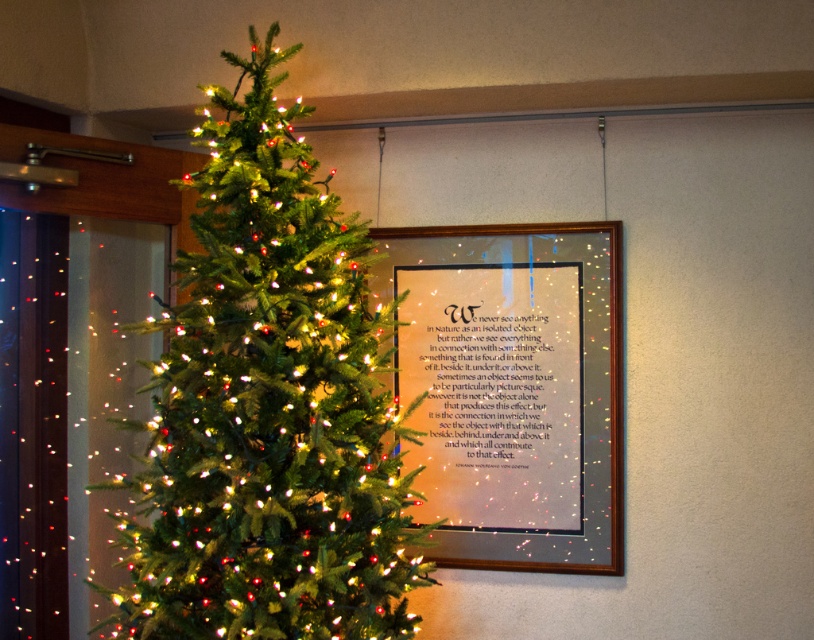
Question: Can you confirm if green matte christmas tree at center is thinner than matte silver frame at center?

Choices:
 (A) yes
 (B) no

Answer: (B)

Question: Which point is farther from the camera taking this photo?

Choices:
 (A) (357, 392)
 (B) (546, 314)

Answer: (B)

Question: Can you confirm if green matte christmas tree at center is bigger than matte silver frame at center?

Choices:
 (A) yes
 (B) no

Answer: (A)

Question: Can you confirm if green matte christmas tree at center is smaller than matte silver frame at center?

Choices:
 (A) yes
 (B) no

Answer: (B)